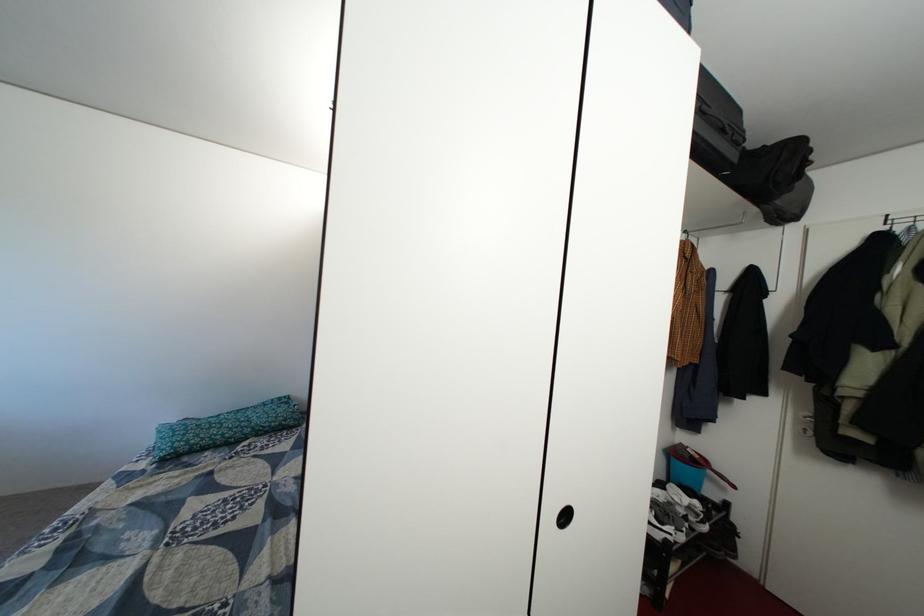
Find the location of a particular element. white door handle is located at coordinates (565, 517).